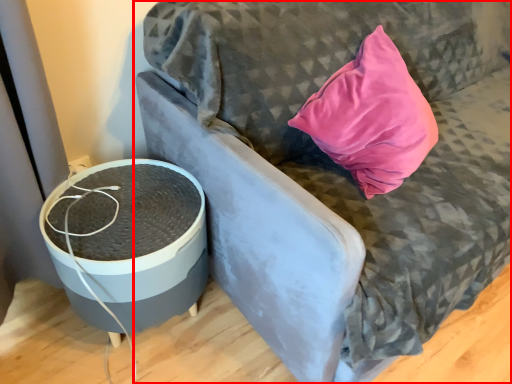
Question: From the image, what is the correct spatial relationship of furniture (annotated by the red box) in relation to round table?

Choices:
 (A) left
 (B) right

Answer: (B)